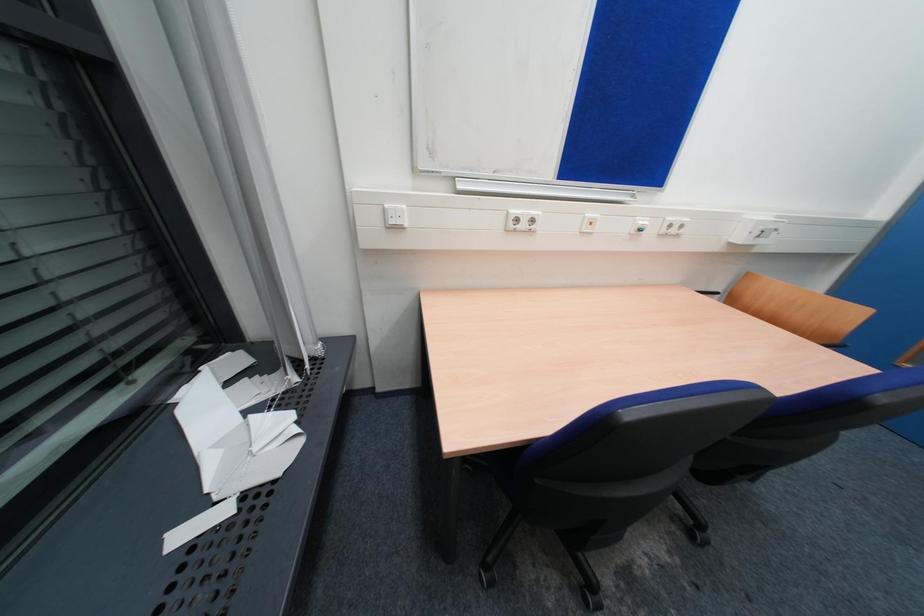
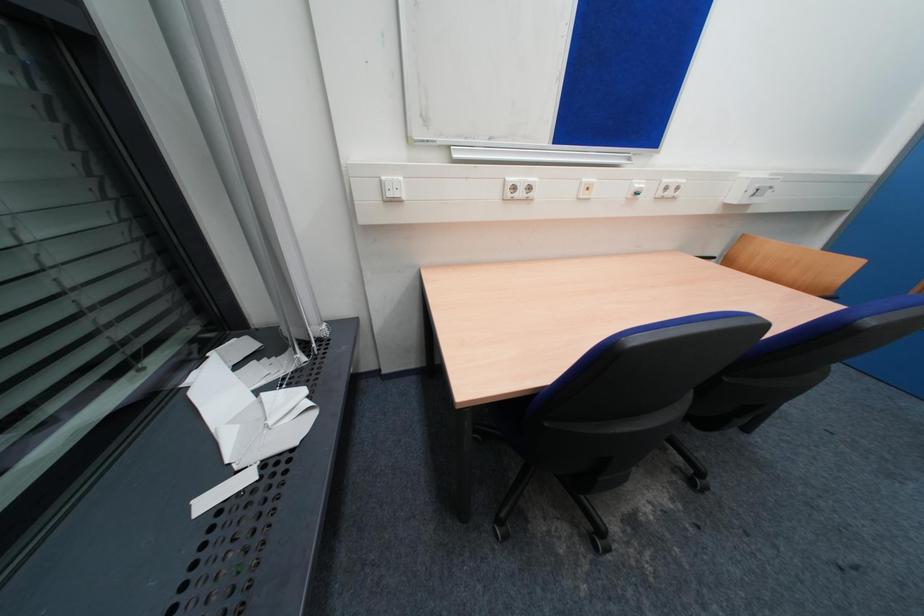
Question: The first image is from the beginning of the video and the second image is from the end. How did the camera likely rotate when shooting the video?

Choices:
 (A) Left
 (B) Right
 (C) Up
 (D) Down

Answer: (D)